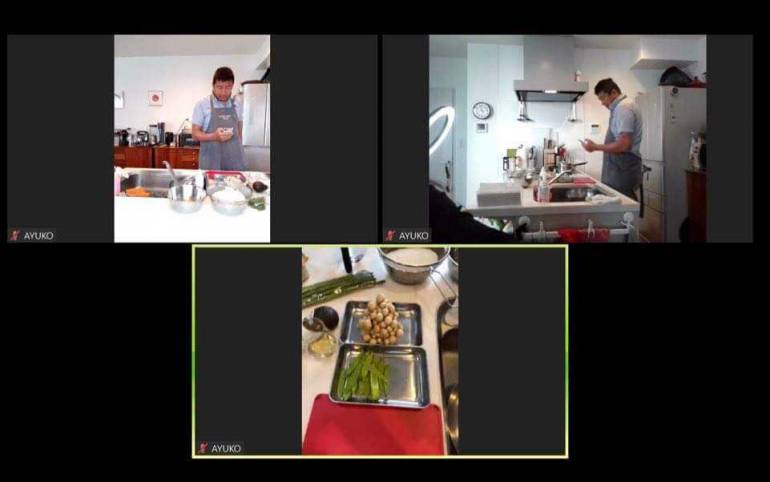
Locate an element on the screen. This screenshot has width=770, height=482. metallic pot is located at coordinates (181, 179), (571, 166).